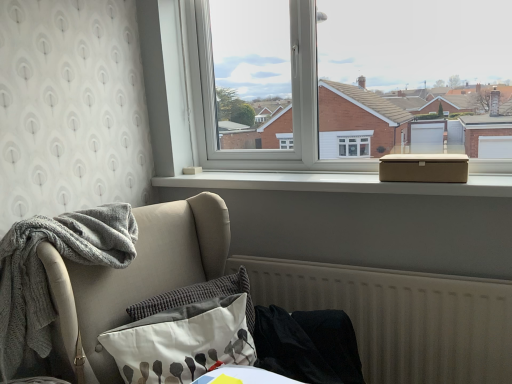
Question: Is textured gray pillow at lower center, marked as the second pillow in a front-to-back arrangement, wider than black fabric at lower right, arranged as the first material when viewed from the right?

Choices:
 (A) no
 (B) yes

Answer: (A)

Question: From a real-world perspective, is textured gray pillow at lower center, marked as the second pillow in a front-to-back arrangement, located beneath black fabric at lower right, arranged as the first material when viewed from the right?

Choices:
 (A) no
 (B) yes

Answer: (A)

Question: From the image's perspective, is textured gray pillow at lower center, marked as the second pillow in a front-to-back arrangement, under black fabric at lower right, arranged as the first material when viewed from the right?

Choices:
 (A) yes
 (B) no

Answer: (B)

Question: Is black fabric at lower right, arranged as the first material when viewed from the right, a part of textured gray pillow at lower center, marked as the second pillow in a front-to-back arrangement?

Choices:
 (A) no
 (B) yes

Answer: (A)

Question: Is the position of textured gray pillow at lower center, acting as the first pillow starting from the back, more distant than that of black fabric at lower right, arranged as the first material when viewed from the right?

Choices:
 (A) no
 (B) yes

Answer: (B)

Question: From a real-world perspective, is textured gray pillow at lower center, acting as the first pillow starting from the back, on top of black fabric at lower right, arranged as the first material when viewed from the right?

Choices:
 (A) yes
 (B) no

Answer: (A)

Question: From a real-world perspective, is textured gray pillow at lower center, marked as the second pillow in a front-to-back arrangement, on top of white smooth window sill at upper center?

Choices:
 (A) no
 (B) yes

Answer: (A)

Question: From a real-world perspective, is textured gray pillow at lower center, acting as the first pillow starting from the back, positioned under white smooth window sill at upper center based on gravity?

Choices:
 (A) yes
 (B) no

Answer: (A)

Question: Can you confirm if textured gray pillow at lower center, marked as the second pillow in a front-to-back arrangement, is wider than white smooth window sill at upper center?

Choices:
 (A) no
 (B) yes

Answer: (A)

Question: Does textured gray pillow at lower center, marked as the second pillow in a front-to-back arrangement, have a larger size compared to white smooth window sill at upper center?

Choices:
 (A) no
 (B) yes

Answer: (A)

Question: Does textured gray pillow at lower center, marked as the second pillow in a front-to-back arrangement, have a greater height compared to white smooth window sill at upper center?

Choices:
 (A) no
 (B) yes

Answer: (B)

Question: Is textured gray pillow at lower center, marked as the second pillow in a front-to-back arrangement, to the left of white smooth window sill at upper center from the viewer's perspective?

Choices:
 (A) yes
 (B) no

Answer: (A)

Question: Is textured gray pillow at lower left, which is the 2th pillow from back to front, to the right of black fabric at lower right, the 2th material positioned from the left, from the viewer's perspective?

Choices:
 (A) yes
 (B) no

Answer: (B)